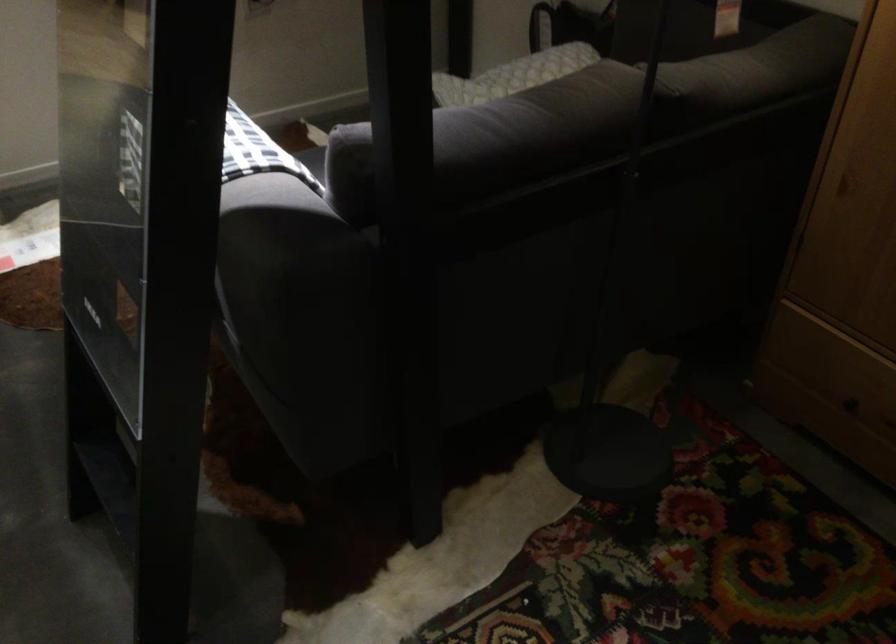
Find where to resting arm the sofa armrest. Please return your answer as a coordinate pair (x, y).

(208, 163)